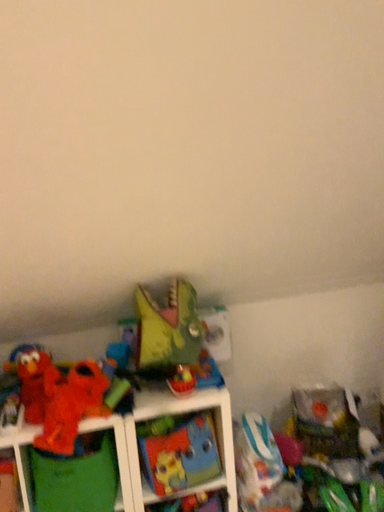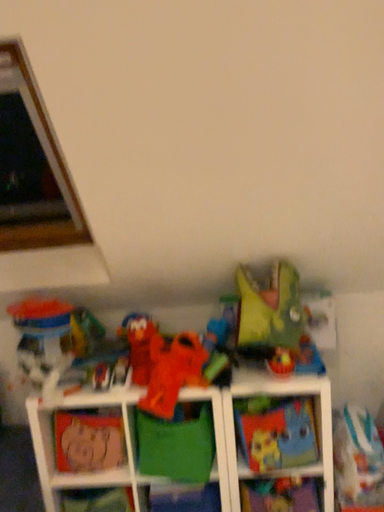
Question: How did the camera likely rotate when shooting the video?

Choices:
 (A) rotated left
 (B) rotated right

Answer: (A)